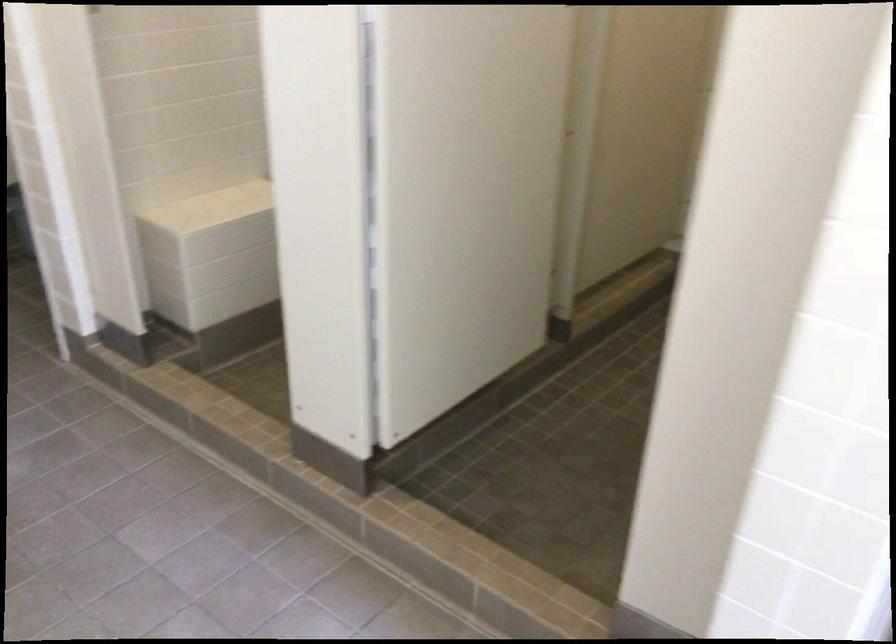
Find the location of `bench sitting surface`. bench sitting surface is located at coordinates (211, 207).